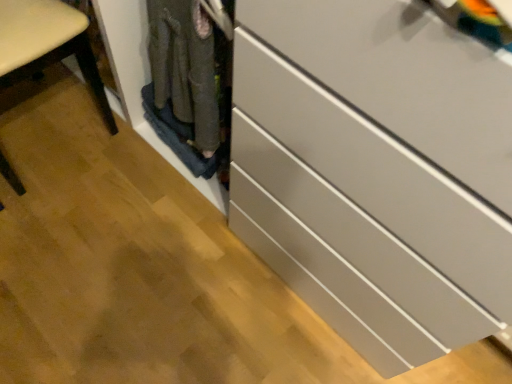
The height and width of the screenshot is (384, 512). Describe the element at coordinates (376, 171) in the screenshot. I see `white glossy chest of drawers at center` at that location.

Identify the location of white glossy chest of drawers at center. The width and height of the screenshot is (512, 384). (x=376, y=171).

Locate an element on the screen. The image size is (512, 384). matte wood chair at left is located at coordinates (47, 45).

This screenshot has width=512, height=384. What do you see at coordinates (47, 45) in the screenshot?
I see `matte wood chair at left` at bounding box center [47, 45].

At what (x,y) coordinates should I click in order to perform the action: click on white glossy chest of drawers at center. Please return your answer as a coordinate pair (x, y). Looking at the image, I should click on (376, 171).

Between matte wood chair at left and white glossy chest of drawers at center, which one appears on the right side from the viewer's perspective?

white glossy chest of drawers at center.

Which is behind, matte wood chair at left or white glossy chest of drawers at center?

matte wood chair at left is further from the camera.

Considering the points (52, 29) and (463, 124), which point is in front, point (52, 29) or point (463, 124)?

The point (463, 124) is in front.

From the image's perspective, is matte wood chair at left on top of white glossy chest of drawers at center?

Yes, from the image's perspective, matte wood chair at left is on top of white glossy chest of drawers at center.

From a real-world perspective, is matte wood chair at left positioned above or below white glossy chest of drawers at center?

matte wood chair at left is above white glossy chest of drawers at center.

Consider the image. Considering the relative sizes of matte wood chair at left and white glossy chest of drawers at center in the image provided, is matte wood chair at left thinner than white glossy chest of drawers at center?

Yes, matte wood chair at left is thinner than white glossy chest of drawers at center.

In the scene shown: Which of these two, matte wood chair at left or white glossy chest of drawers at center, stands taller?

With more height is matte wood chair at left.

Who is bigger, matte wood chair at left or white glossy chest of drawers at center?

white glossy chest of drawers at center is bigger.

Is white glossy chest of drawers at center located within matte wood chair at left?

No.

Are matte wood chair at left and white glossy chest of drawers at center far apart?

No.

Is matte wood chair at left facing towards white glossy chest of drawers at center?

Yes.

What's the angular difference between matte wood chair at left and white glossy chest of drawers at center's facing directions?

The angle between the facing direction of matte wood chair at left and the facing direction of white glossy chest of drawers at center is 86.7 degrees.

What are the coordinates of `chest of drawers on the right of the matte wood chair at left` in the screenshot? It's located at (376, 171).

Considering the positions of objects white glossy chest of drawers at center and matte wood chair at left in the image provided, who is more to the right, white glossy chest of drawers at center or matte wood chair at left?

From the viewer's perspective, white glossy chest of drawers at center appears more on the right side.

Is white glossy chest of drawers at center in front of or behind matte wood chair at left in the image?

white glossy chest of drawers at center is in front of matte wood chair at left.

Between point (426, 279) and point (41, 61), which one is positioned behind?

The point (41, 61) is behind.

From the image's perspective, is white glossy chest of drawers at center over matte wood chair at left?

No, from the image's perspective, white glossy chest of drawers at center is not above matte wood chair at left.

From a real-world perspective, is white glossy chest of drawers at center physically located above or below matte wood chair at left?

Clearly, from a real-world perspective, white glossy chest of drawers at center is below matte wood chair at left.

Considering the sizes of white glossy chest of drawers at center and matte wood chair at left in the image, is white glossy chest of drawers at center wider or thinner than matte wood chair at left?

In the image, white glossy chest of drawers at center appears to be wider than matte wood chair at left.

Is white glossy chest of drawers at center taller than matte wood chair at left?

Incorrect, the height of white glossy chest of drawers at center is not larger of that of matte wood chair at left.

From the picture: Between white glossy chest of drawers at center and matte wood chair at left, which one has larger size?

white glossy chest of drawers at center is bigger.

Is white glossy chest of drawers at center spatially inside matte wood chair at left, or outside of it?

white glossy chest of drawers at center is not enclosed by matte wood chair at left.

Is white glossy chest of drawers at center not close to matte wood chair at left?

No, there isn't a large distance between white glossy chest of drawers at center and matte wood chair at left.

Is matte wood chair at left at the back of white glossy chest of drawers at center?

No, white glossy chest of drawers at center is not facing away from matte wood chair at left.

Based on the photo, how different are the orientations of white glossy chest of drawers at center and matte wood chair at left in degrees?

86.7 degrees separate the facing orientations of white glossy chest of drawers at center and matte wood chair at left.

Measure the distance between white glossy chest of drawers at center and matte wood chair at left.

white glossy chest of drawers at center is 33.08 inches from matte wood chair at left.

The height and width of the screenshot is (384, 512). I want to click on furniture above the white glossy chest of drawers at center (from a real-world perspective), so click(x=47, y=45).

Where is `chest of drawers in front of the matte wood chair at left`? chest of drawers in front of the matte wood chair at left is located at coordinates (376, 171).

Find the location of `chest of drawers to the right of matte wood chair at left`. chest of drawers to the right of matte wood chair at left is located at coordinates (376, 171).